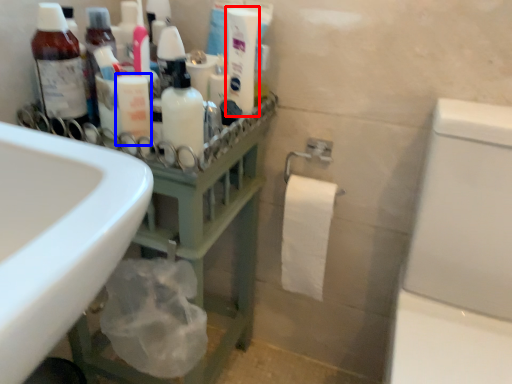
Question: Which of the following is the closest to the observer, cleaning product (highlighted by a red box) or toiletry (highlighted by a blue box)?

Choices:
 (A) cleaning product
 (B) toiletry

Answer: (B)